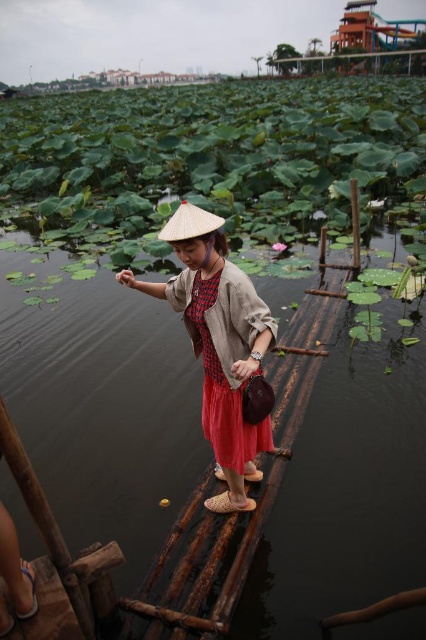
Question: Is dark brown water at center further to the viewer compared to matte brown hat at center?

Choices:
 (A) no
 (B) yes

Answer: (B)

Question: Which object is the farthest from the dark brown water at center?

Choices:
 (A) natural straw hat at center
 (B) matte brown hat at center

Answer: (A)

Question: Does matte brown hat at center have a larger size compared to natural straw hat at center?

Choices:
 (A) no
 (B) yes

Answer: (B)

Question: Is dark brown water at center positioned at the back of natural straw hat at center?

Choices:
 (A) no
 (B) yes

Answer: (B)

Question: Which object is the farthest from the matte brown hat at center?

Choices:
 (A) dark brown water at center
 (B) natural straw hat at center

Answer: (A)

Question: Which object appears farthest from the camera in this image?

Choices:
 (A) dark brown water at center
 (B) matte brown hat at center

Answer: (A)